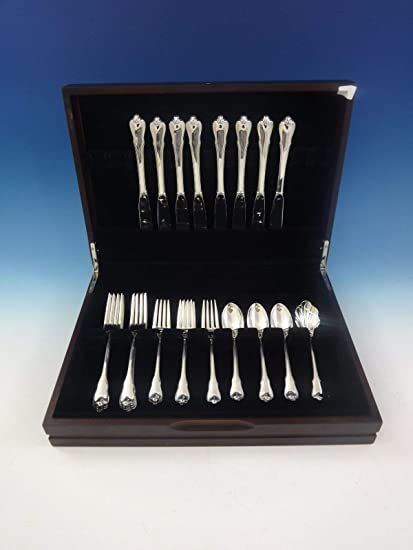
What are the coordinates of `forks` in the screenshot? It's located at (108, 329), (137, 331), (156, 330), (184, 331), (214, 335).